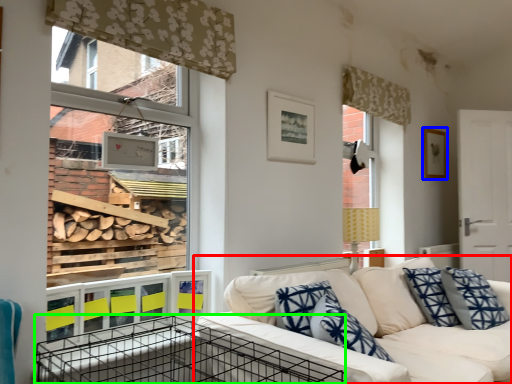
Question: Which object is the closest to the studio couch (highlighted by a red box)? Choose among these: picture frame (highlighted by a blue box) or crate (highlighted by a green box).

Choices:
 (A) picture frame
 (B) crate

Answer: (B)